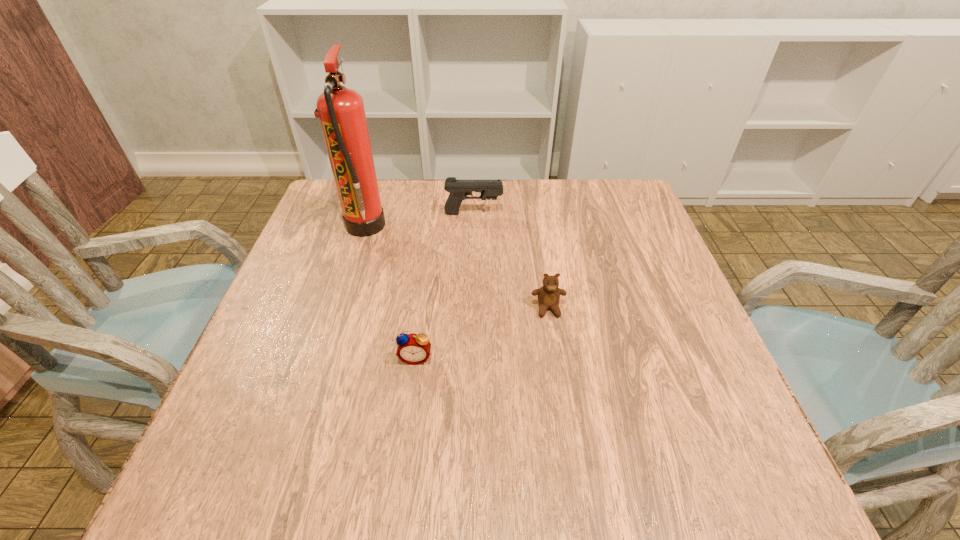
This screenshot has height=540, width=960. Identify the location of fire extinguisher. (341, 111).

You are a GUI agent. You are given a task and a screenshot of the screen. Output one action in this format:
    pyautogui.click(x=<x>, y=<y>)
    Task: Click on the leftmost object
    
    Given the screenshot: What is the action you would take?
    pyautogui.click(x=341, y=111)

Locate an element on the screen. The image size is (960, 540). the second tallest object is located at coordinates (459, 189).

You are a GUI agent. You are given a task and a screenshot of the screen. Output one action in this format:
    pyautogui.click(x=<x>, y=<y>)
    Task: Click on the third farthest object
    The image size is (960, 540).
    Given the screenshot: What is the action you would take?
    pyautogui.click(x=549, y=294)

Locate an element on the screen. the rightmost object is located at coordinates (549, 294).

Image resolution: width=960 pixels, height=540 pixels. Find the location of `the nearest object`. the nearest object is located at coordinates (414, 349).

Locate an element on the screen. vacant area situated 0.290m with the nozzle pointing from the back of the fire extinguisher is located at coordinates (497, 226).

You are a GUI agent. You are given a task and a screenshot of the screen. Output one action in this format:
    pyautogui.click(x=<x>, y=<y>)
    Task: Click on the vacant point located 0.320m at the barrel of the third shortest object
    The height and width of the screenshot is (540, 960).
    Given the screenshot: What is the action you would take?
    pyautogui.click(x=621, y=213)

Where is `vacant space positioned at the face of the third farthest object`? The height and width of the screenshot is (540, 960). vacant space positioned at the face of the third farthest object is located at coordinates (558, 367).

You are a GUI agent. You are given a task and a screenshot of the screen. Output one action in this format:
    pyautogui.click(x=<x>, y=<y>)
    Task: Click on the vacant position located on the front-facing side of the nearest object
    
    Given the screenshot: What is the action you would take?
    pyautogui.click(x=403, y=454)